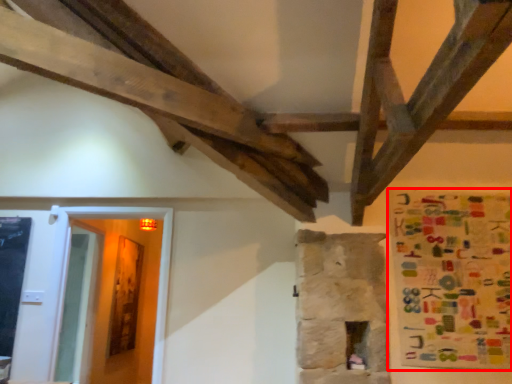
Question: From the image's perspective, what is the correct spatial relationship of poster (annotated by the red box) in relation to glass door?

Choices:
 (A) below
 (B) above

Answer: (B)